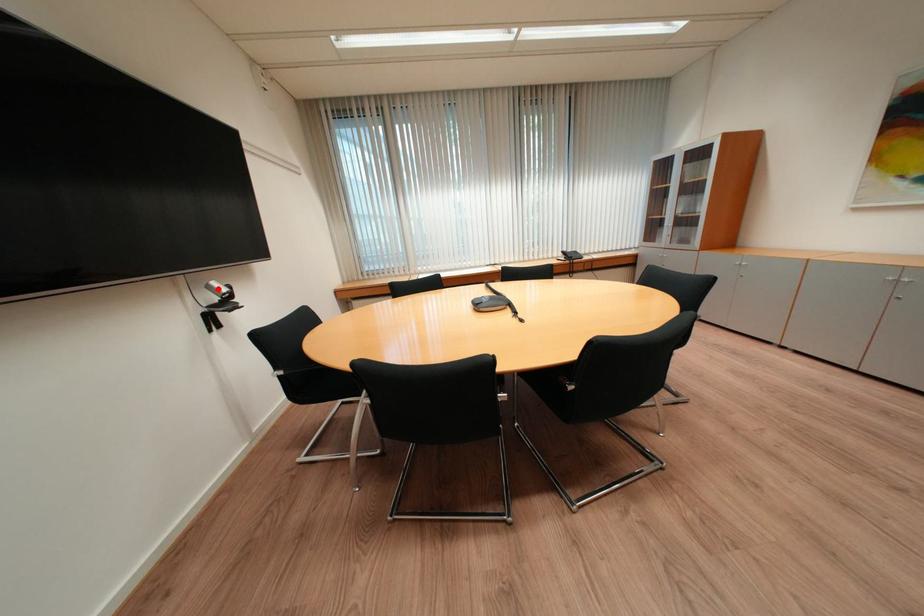
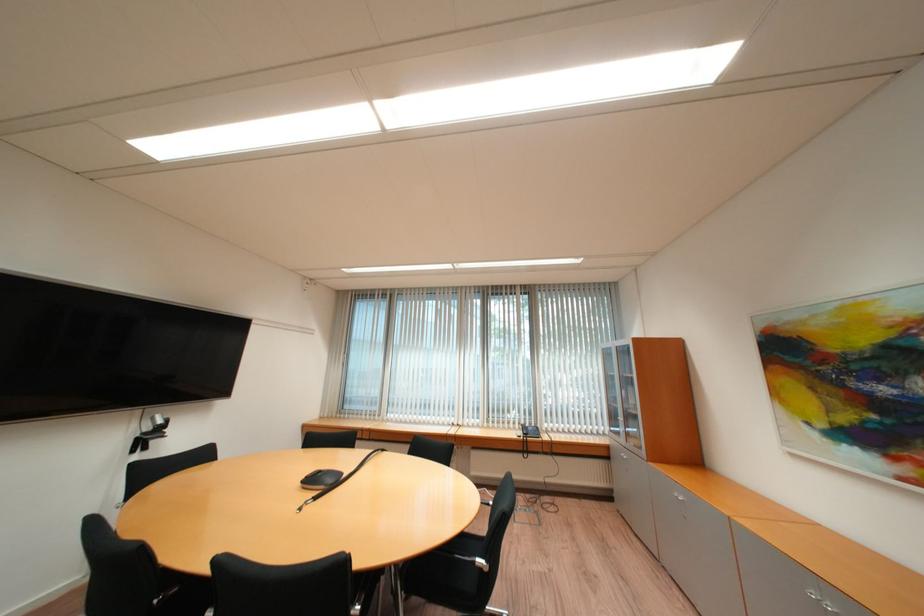
Where in the second image is the point corresponding to the highlighted location from the first image?

(162, 419)